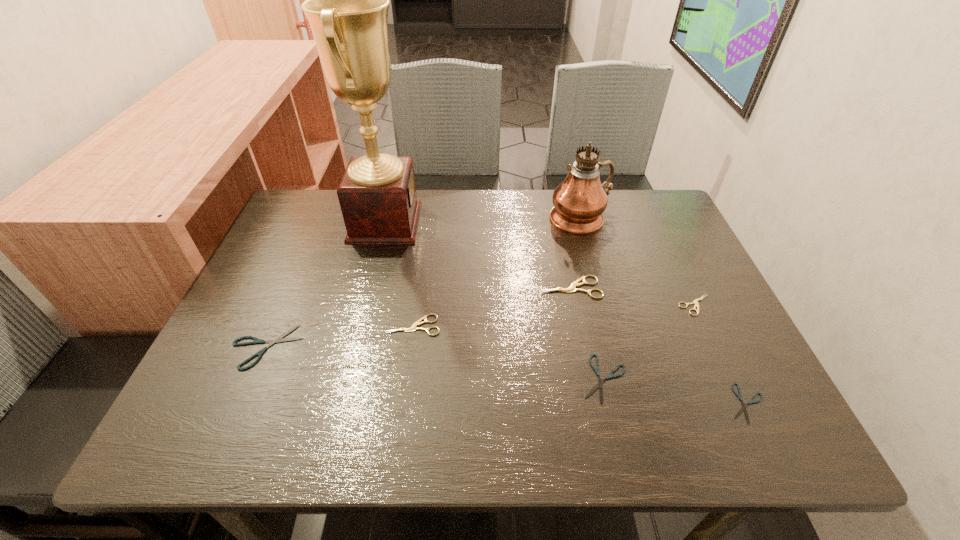
Locate an element on the screen. The image size is (960, 540). trophy cup situated at the far edge is located at coordinates (347, 0).

Where is `oil lamp present at the far edge`? The width and height of the screenshot is (960, 540). oil lamp present at the far edge is located at coordinates (579, 201).

Find the location of a particular element. Image resolution: width=960 pixels, height=540 pixels. object that is at the left edge is located at coordinates (256, 341).

Find the location of a particular element. The height and width of the screenshot is (540, 960). object that is at the near right corner is located at coordinates (744, 408).

This screenshot has height=540, width=960. In order to click on free space at the far edge of the desktop in this screenshot , I will do `click(503, 192)`.

You are a GUI agent. You are given a task and a screenshot of the screen. Output one action in this format:
    pyautogui.click(x=<x>, y=<y>)
    Task: Click on the vacant space at the near edge of the desktop
    This screenshot has height=540, width=960.
    Given the screenshot: What is the action you would take?
    pyautogui.click(x=488, y=408)

Where is `free space at the left edge of the desktop`? free space at the left edge of the desktop is located at coordinates (253, 278).

This screenshot has width=960, height=540. I want to click on vacant space at the right edge of the desktop, so click(699, 396).

Where is `vacant space at the far left corner of the desktop`? Image resolution: width=960 pixels, height=540 pixels. vacant space at the far left corner of the desktop is located at coordinates (298, 209).

Find the location of a particular element. This screenshot has height=540, width=960. free region at the near left corner is located at coordinates (204, 421).